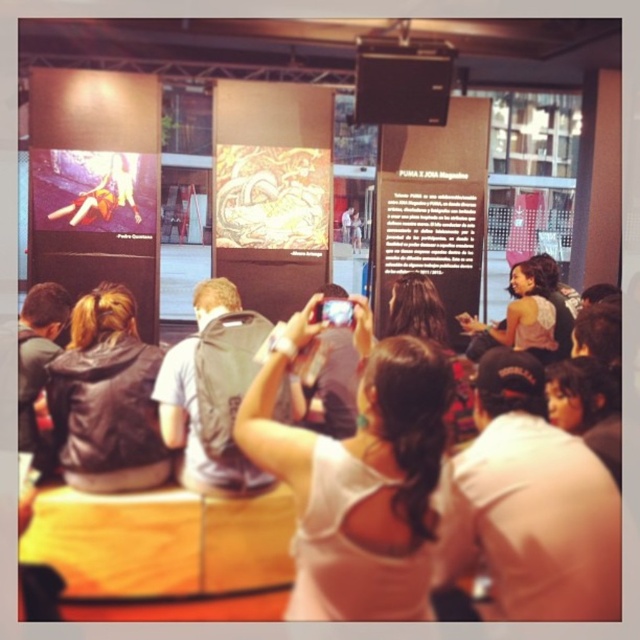
Question: Can you confirm if white fabric at center is wider than white fabric crowd at center?

Choices:
 (A) yes
 (B) no

Answer: (B)

Question: Does white fabric at center appear on the left side of white fabric crowd at center?

Choices:
 (A) no
 (B) yes

Answer: (A)

Question: Can you confirm if white fabric at center is positioned to the right of white fabric crowd at center?

Choices:
 (A) yes
 (B) no

Answer: (A)